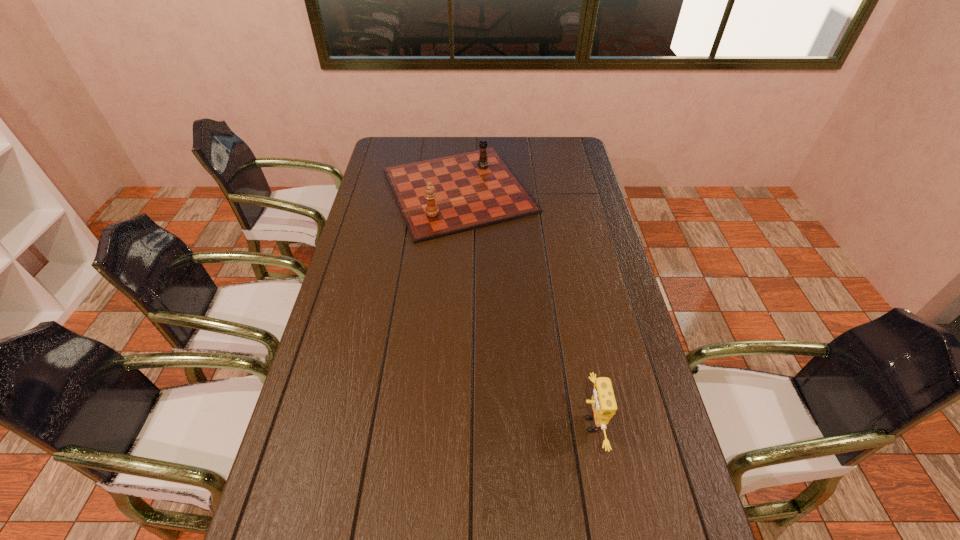
Locate an element on the screen. This screenshot has width=960, height=540. object located at the right edge is located at coordinates click(603, 404).

At what (x,y) coordinates should I click in order to perform the action: click on object located in the far left corner section of the desktop. Please return your answer as a coordinate pair (x, y). The image size is (960, 540). Looking at the image, I should click on (442, 196).

The height and width of the screenshot is (540, 960). In the image, there is a desktop. What are the coordinates of `vacant space at the far edge` in the screenshot? It's located at (531, 156).

Identify the location of vacant region at the left edge. (382, 257).

The width and height of the screenshot is (960, 540). I want to click on free location at the right edge of the desktop, so click(602, 373).

Where is `free space at the far left corner of the desktop`? free space at the far left corner of the desktop is located at coordinates (385, 143).

The width and height of the screenshot is (960, 540). Identify the location of free region at the far right corner of the desktop. (555, 145).

Where is `free area in between the farther object and the sponge`? free area in between the farther object and the sponge is located at coordinates (524, 307).

Identify the location of vacant space in between the gameboard and the nearer object. This screenshot has height=540, width=960. (524, 307).

Where is `free point between the right object and the left object`? This screenshot has height=540, width=960. free point between the right object and the left object is located at coordinates (524, 307).